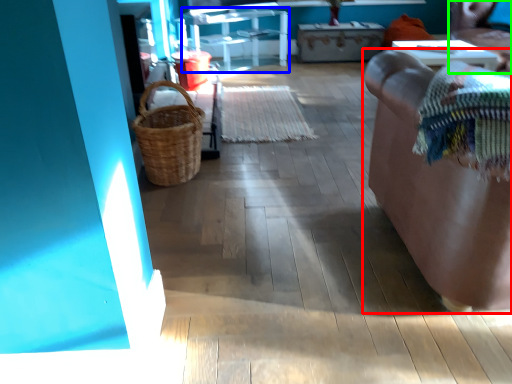
Question: Which is nearer to the furniture (highlighted by a red box)? furniture (highlighted by a blue box) or chair (highlighted by a green box).

Choices:
 (A) furniture
 (B) chair

Answer: (B)